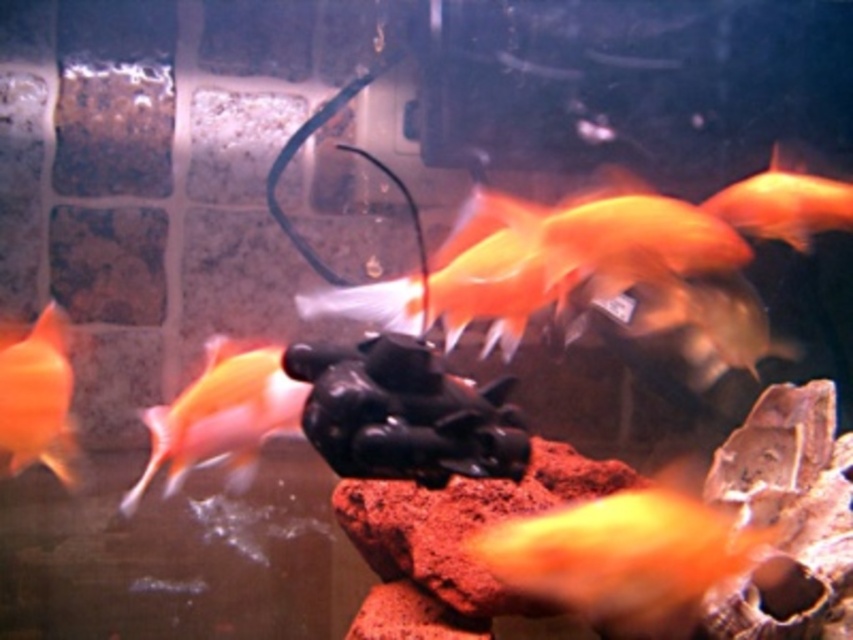
This screenshot has width=853, height=640. Describe the element at coordinates (624, 556) in the screenshot. I see `shiny orange fish at center` at that location.

Does point (618, 548) lie in front of point (204, 378)?

No, it is behind (204, 378).

Identify the location of shiny orange fish at center. (624, 556).

Does shiny orange fish at center lie behind orange matte goldfish at upper right?

No.

Consider the image. Can you confirm if shiny orange fish at center is taller than orange matte goldfish at upper right?

No, shiny orange fish at center is not taller than orange matte goldfish at upper right.

Measure the distance between shiny orange fish at center and camera.

shiny orange fish at center and camera are 1.69 meters apart.

You are a GUI agent. You are given a task and a screenshot of the screen. Output one action in this format:
    pyautogui.click(x=<x>, y=<y>)
    Task: Click on the shiny orange fish at center
    
    Given the screenshot: What is the action you would take?
    pyautogui.click(x=624, y=556)

Between point (231, 378) and point (10, 422), which one is positioned behind?

Positioned behind is point (231, 378).

Between point (252, 353) and point (26, 461), which one is positioned behind?

Point (252, 353)

Image resolution: width=853 pixels, height=640 pixels. Find the location of `matte orange fish at lower left`. matte orange fish at lower left is located at coordinates click(x=221, y=416).